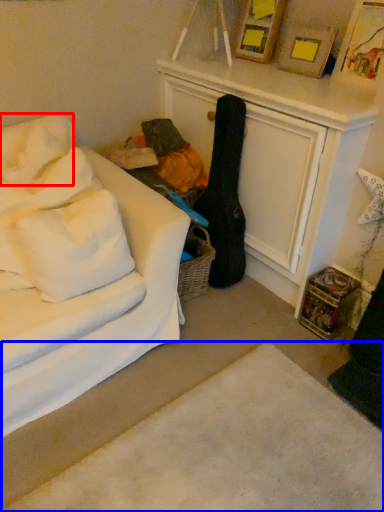
Question: Which object is closer to the camera taking this photo, pillow (highlighted by a red box) or plain (highlighted by a blue box)?

Choices:
 (A) pillow
 (B) plain

Answer: (B)